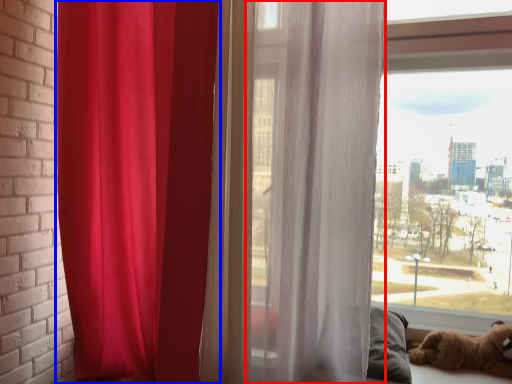
Question: Which object appears farthest to the camera in this image, curtain (highlighted by a red box) or curtain (highlighted by a blue box)?

Choices:
 (A) curtain
 (B) curtain

Answer: (B)